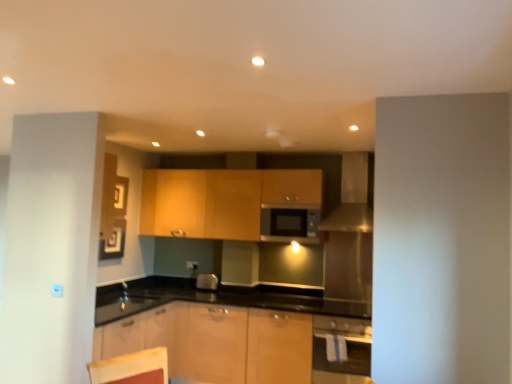
Question: Is white glossy oven at lower right inside or outside of matte wood cabinets at center?

Choices:
 (A) outside
 (B) inside

Answer: (A)

Question: Does point (316, 347) appear closer or farther from the camera than point (316, 201)?

Choices:
 (A) closer
 (B) farther

Answer: (A)

Question: Which of these objects is positioned farthest from the matte silver microwave at center?

Choices:
 (A) white glossy oven at lower right
 (B) satin silver exhaust hood at upper right
 (C) matte wood cabinets at center

Answer: (A)

Question: Considering the real-world distances, which object is closest to the matte silver microwave at center?

Choices:
 (A) satin silver exhaust hood at upper right
 (B) white glossy oven at lower right
 (C) matte wood cabinets at center

Answer: (A)